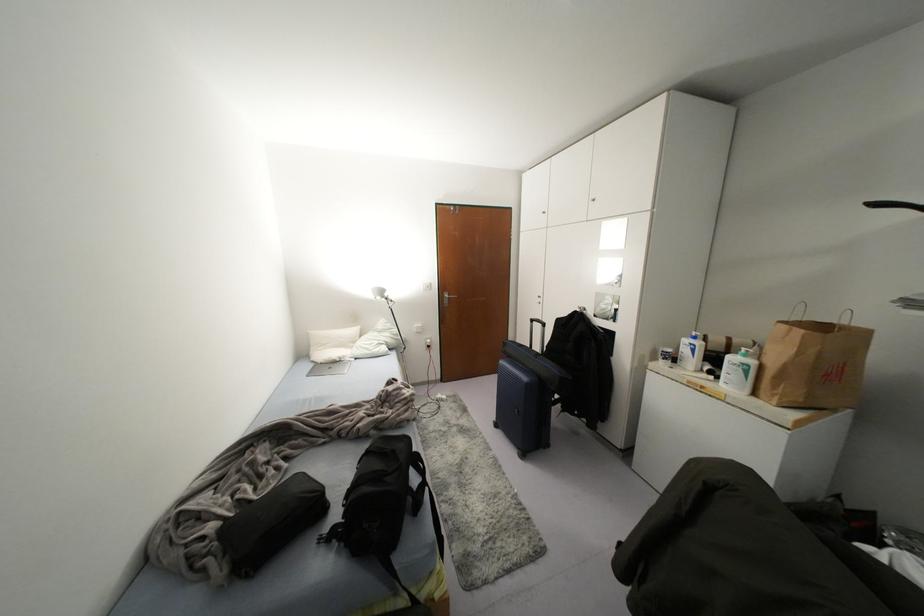
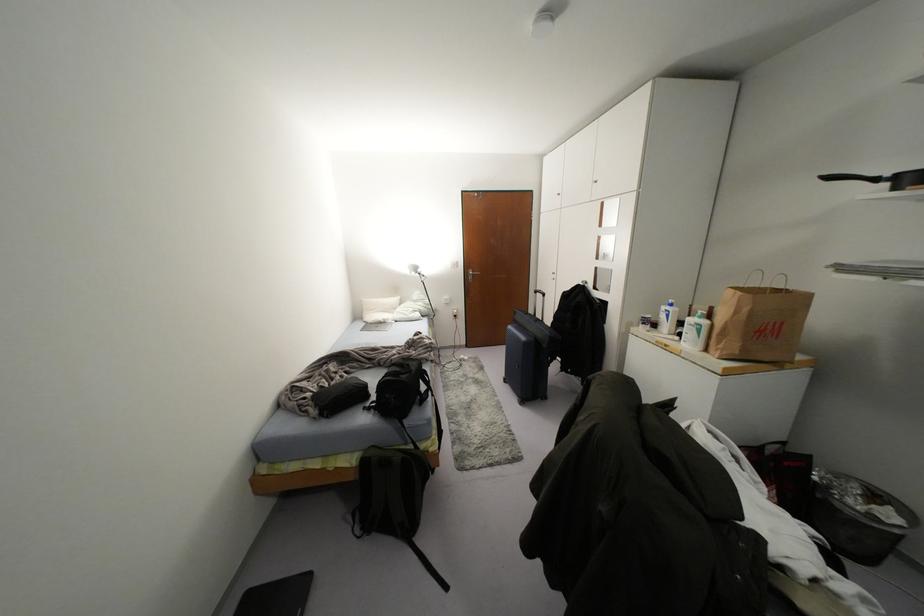
Where in the second image is the point corresponding to point 385,294 from the first image?

(419, 270)